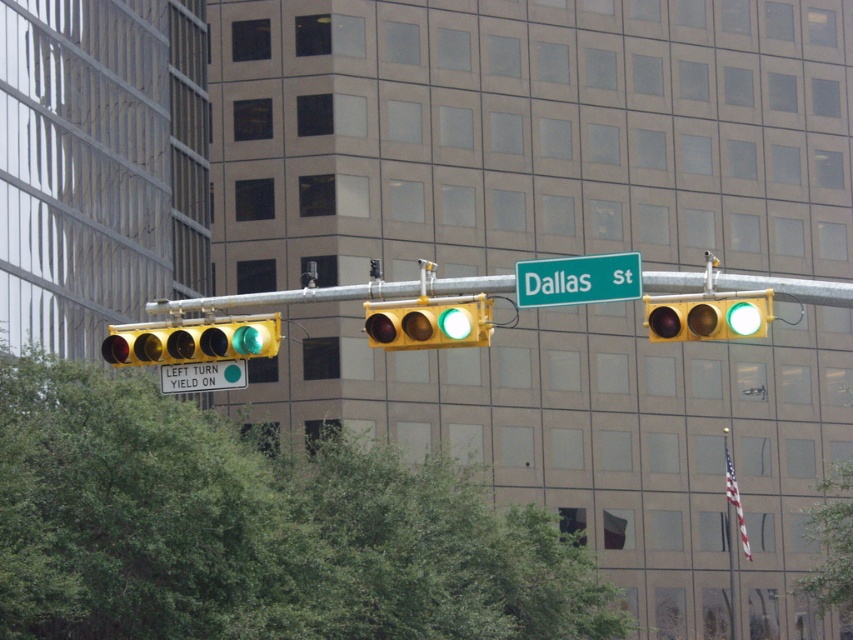
Question: Is yellow matte traffic light at left smaller than yellow matte traffic light at center?

Choices:
 (A) no
 (B) yes

Answer: (A)

Question: Which object is positioned closest to the yellow matte traffic light at center?

Choices:
 (A) green leafy tree at lower left
 (B) yellow matte traffic light at left
 (C) green leafy tree at center
 (D) green matte sign at upper center

Answer: (B)

Question: Observing the image, what is the correct spatial positioning of metallic silver pole at center in reference to green matte sign at upper center?

Choices:
 (A) left
 (B) right

Answer: (B)

Question: Estimate the real-world distances between objects in this image. Which object is closer to the green leafy tree at lower left?

Choices:
 (A) green matte sign at upper center
 (B) green metallic street sign at upper center
 (C) yellow plastic traffic light at center right

Answer: (A)

Question: Estimate the real-world distances between objects in this image. Which object is closer to the metallic silver pole at center?

Choices:
 (A) green leafy tree at lower left
 (B) green matte sign at upper center
 (C) yellow plastic traffic light at center right

Answer: (C)

Question: Does green leafy tree at center appear under yellow plastic traffic light at center right?

Choices:
 (A) yes
 (B) no

Answer: (A)